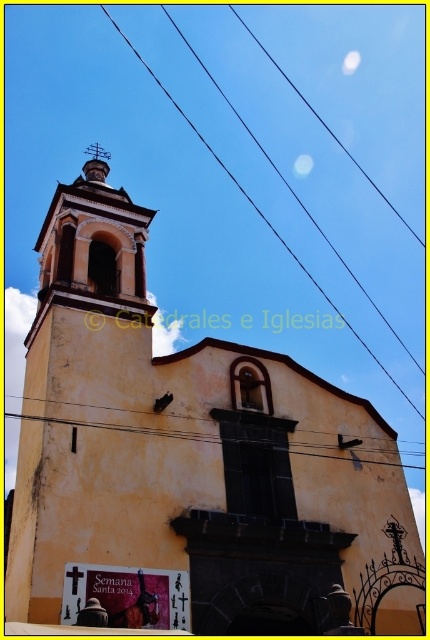
Question: Observing the image, what is the correct spatial positioning of yellowish matte power line at center in reference to smooth gold spire at upper center?

Choices:
 (A) right
 (B) left

Answer: (A)

Question: Which object is farther from the camera taking this photo?

Choices:
 (A) smooth gold spire at upper center
 (B) black wire at upper center

Answer: (B)

Question: Is black wire at upper center to the right of smooth gold spire at upper center from the viewer's perspective?

Choices:
 (A) yes
 (B) no

Answer: (A)

Question: Which object is farther from the camera taking this photo?

Choices:
 (A) yellowish matte power line at center
 (B) black wire at upper center
 (C) smooth gold spire at upper center

Answer: (B)

Question: Which object is the closest to the black wire at upper center?

Choices:
 (A) smooth gold spire at upper center
 (B) yellowish matte power line at center

Answer: (A)

Question: Can you confirm if black wire at upper center is positioned to the right of smooth gold spire at upper center?

Choices:
 (A) yes
 (B) no

Answer: (A)